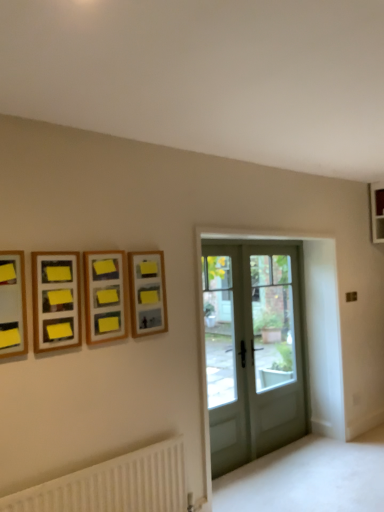
Question: Is wooden picture frame at left, the 1th picture frame when ordered from left to right, directly adjacent to clear glass door at center, the 1th screen door when ordered from left to right?

Choices:
 (A) yes
 (B) no

Answer: (B)

Question: From the image's perspective, does wooden picture frame at left, the 1th picture frame when ordered from left to right, appear lower than clear glass door at center, the 1th screen door when ordered from left to right?

Choices:
 (A) yes
 (B) no

Answer: (B)

Question: Is wooden picture frame at left, the 4th picture frame viewed from the right, turned away from clear glass door at center, the 1th screen door when ordered from left to right?

Choices:
 (A) no
 (B) yes

Answer: (A)

Question: Does wooden picture frame at left, arranged as the fourth picture frame when viewed from the back, have a larger size compared to clear glass door at center, the second screen door when ordered from right to left?

Choices:
 (A) yes
 (B) no

Answer: (B)

Question: Considering the relative positions of wooden picture frame at left, arranged as the fourth picture frame when viewed from the back, and clear glass door at center, the 1th screen door when ordered from left to right, in the image provided, is wooden picture frame at left, arranged as the fourth picture frame when viewed from the back, to the left of clear glass door at center, the 1th screen door when ordered from left to right, from the viewer's perspective?

Choices:
 (A) no
 (B) yes

Answer: (B)

Question: From the image's perspective, is white textured radiator at lower left above or below clear glass door at center, the 1th screen door positioned from the front?

Choices:
 (A) above
 (B) below

Answer: (B)

Question: Considering the positions of point (46, 496) and point (226, 245), is point (46, 496) closer or farther from the camera than point (226, 245)?

Choices:
 (A) farther
 (B) closer

Answer: (B)

Question: Considering the positions of white textured radiator at lower left and clear glass door at center, the 1th screen door when ordered from left to right, in the image, is white textured radiator at lower left taller or shorter than clear glass door at center, the 1th screen door when ordered from left to right,?

Choices:
 (A) tall
 (B) short

Answer: (B)

Question: Is white textured radiator at lower left spatially inside clear glass door at center, the 1th screen door when ordered from left to right, or outside of it?

Choices:
 (A) outside
 (B) inside

Answer: (A)

Question: From the image's perspective, is clear glass door at center, the 1th screen door positioned from the front, above or below white glass screen door at center, which appears as the second screen door when viewed from the front?

Choices:
 (A) below
 (B) above

Answer: (A)

Question: Considering the positions of point (223, 252) and point (258, 417), is point (223, 252) closer or farther from the camera than point (258, 417)?

Choices:
 (A) farther
 (B) closer

Answer: (B)

Question: Is clear glass door at center, the 1th screen door positioned from the front, wider or thinner than white glass screen door at center, acting as the 1th screen door starting from the back?

Choices:
 (A) thin
 (B) wide

Answer: (B)

Question: In the image, is clear glass door at center, the 2th screen door when ordered from back to front, positioned in front of or behind white glass screen door at center, the first screen door in the right-to-left sequence?

Choices:
 (A) front
 (B) behind

Answer: (A)

Question: Considering the positions of point (297, 358) and point (44, 331), is point (297, 358) closer or farther from the camera than point (44, 331)?

Choices:
 (A) closer
 (B) farther

Answer: (B)

Question: In terms of height, does matte glass door at center look taller or shorter compared to wooden frame at upper left, which is the third picture frame in right-to-left order?

Choices:
 (A) short
 (B) tall

Answer: (B)